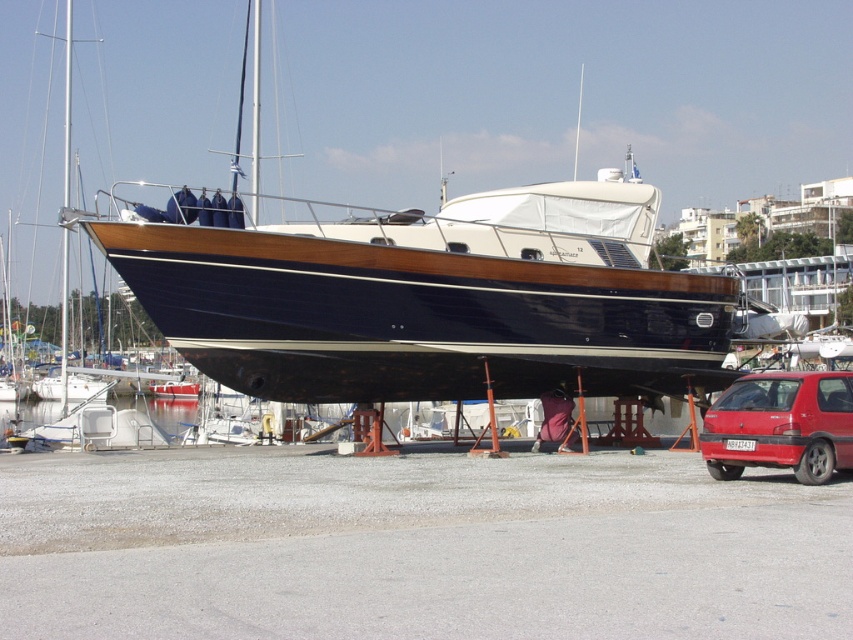
You are standing at the edge of the marina and want to take a photo of the shiny dark wood boat at center. If your camera has a maximum zoom range of 50 feet, will you be able to get a clear closeup shot without moving closer?

The distance between you and the shiny dark wood boat at center is 55.33 feet, which exceeds the camera zoom range of 50 feet. Therefore, you won cannot get a clear closeup shot without moving closer.

What are the coordinates of the shiny dark wood boat at center?

The coordinates of the shiny dark wood boat at center are at point (434, 300).

You are a delivery person who needs to unload a package that requires a 6 meter clearance between the shiny dark wood boat at center and the matte red hatchback at lower right. Can you safely move the package between them?

The distance between the shiny dark wood boat at center and the matte red hatchback at lower right is 5.97 meters, which is slightly less than the required 6 meters. Therefore, the package cannot be safely moved between them due to insufficient clearance.